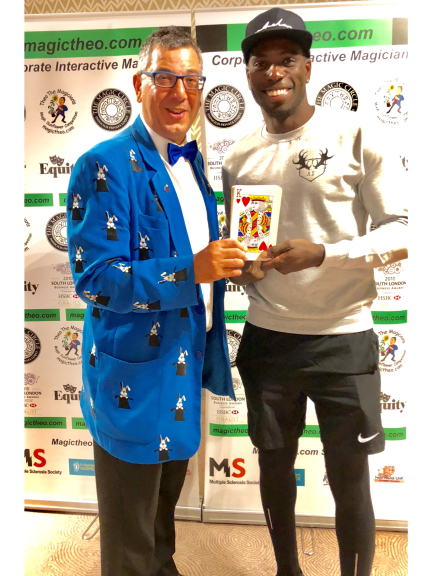
You are a GUI agent. You are given a task and a screenshot of the screen. Output one action in this format:
    pyautogui.click(x=<x>, y=<y>)
    Task: Click on the king of hearts picture
    The width and height of the screenshot is (432, 576).
    Given the screenshot: What is the action you would take?
    pyautogui.click(x=255, y=221)